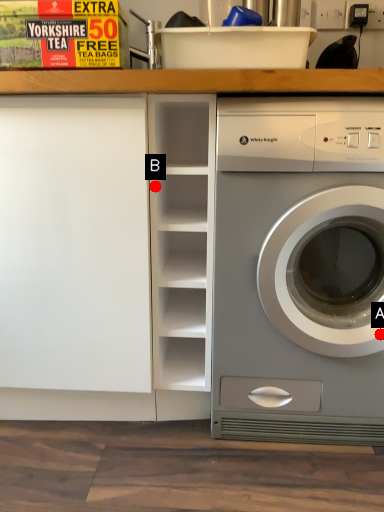
Question: Two points are circled on the image, labeled by A and B beside each circle. Among these points, which one is nearest to the camera?

Choices:
 (A) A is closer
 (B) B is closer

Answer: (A)